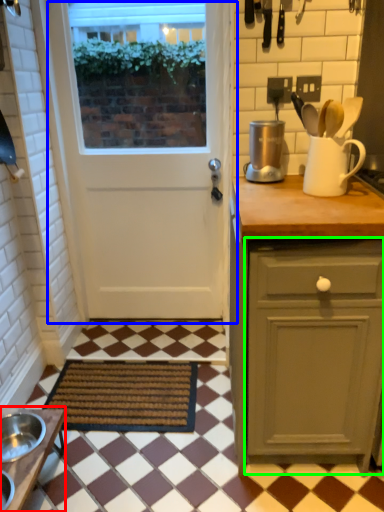
Question: Considering the real-world distances, which object is closest to table (highlighted by a red box)? door (highlighted by a blue box) or cabinetry (highlighted by a green box).

Choices:
 (A) door
 (B) cabinetry

Answer: (B)